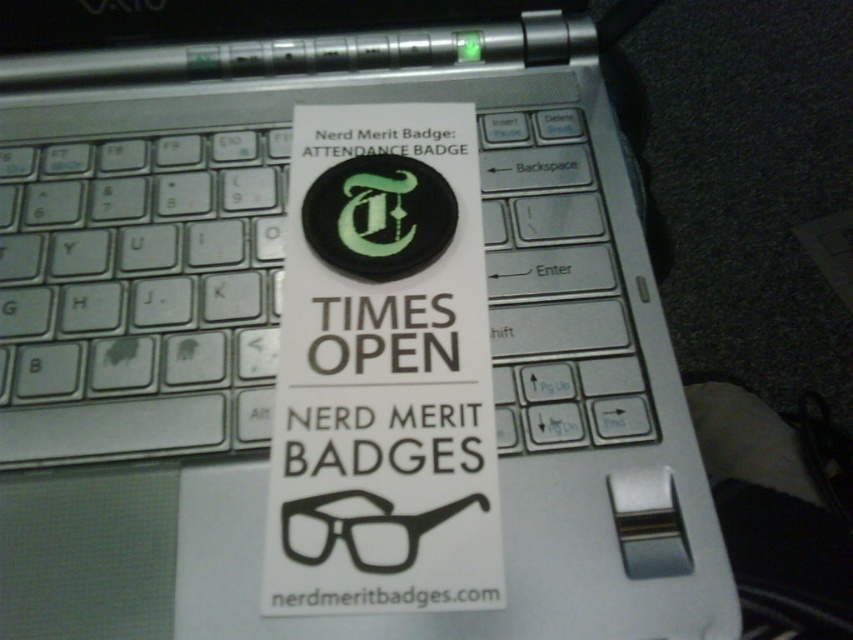
Question: Can you confirm if white paper sticker at center is positioned above black matte glasses at center?

Choices:
 (A) yes
 (B) no

Answer: (A)

Question: Which object is closer to the camera taking this photo?

Choices:
 (A) black matte glasses at center
 (B) white paper sticker at center

Answer: (B)

Question: Which object appears farthest from the camera in this image?

Choices:
 (A) black matte glasses at center
 (B) white paper sticker at center

Answer: (A)

Question: Which point is closer to the camera taking this photo?

Choices:
 (A) (332, 225)
 (B) (404, 536)

Answer: (B)

Question: Is the position of white paper sticker at center more distant than that of black matte glasses at center?

Choices:
 (A) no
 (B) yes

Answer: (A)

Question: Does white paper sticker at center have a greater width compared to black matte glasses at center?

Choices:
 (A) yes
 (B) no

Answer: (A)